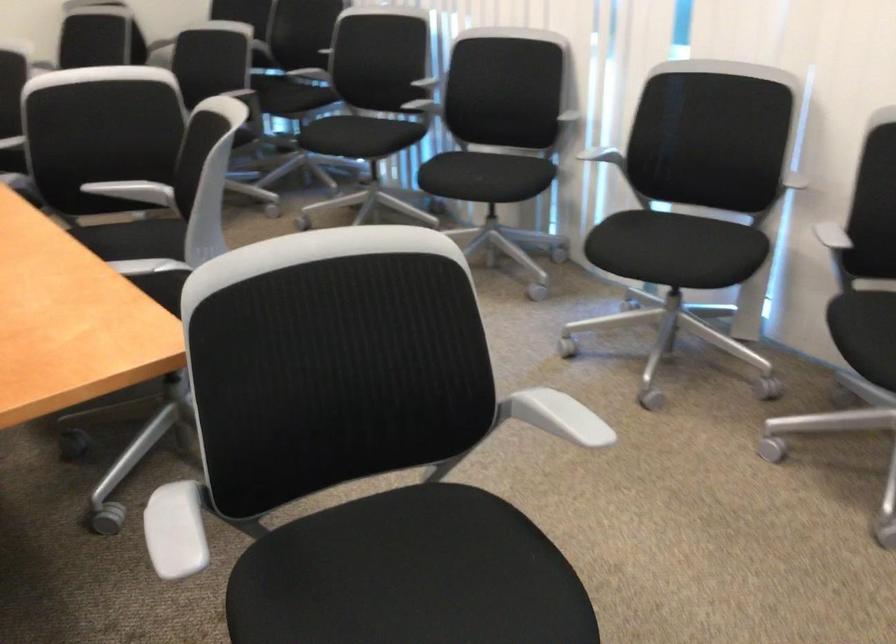
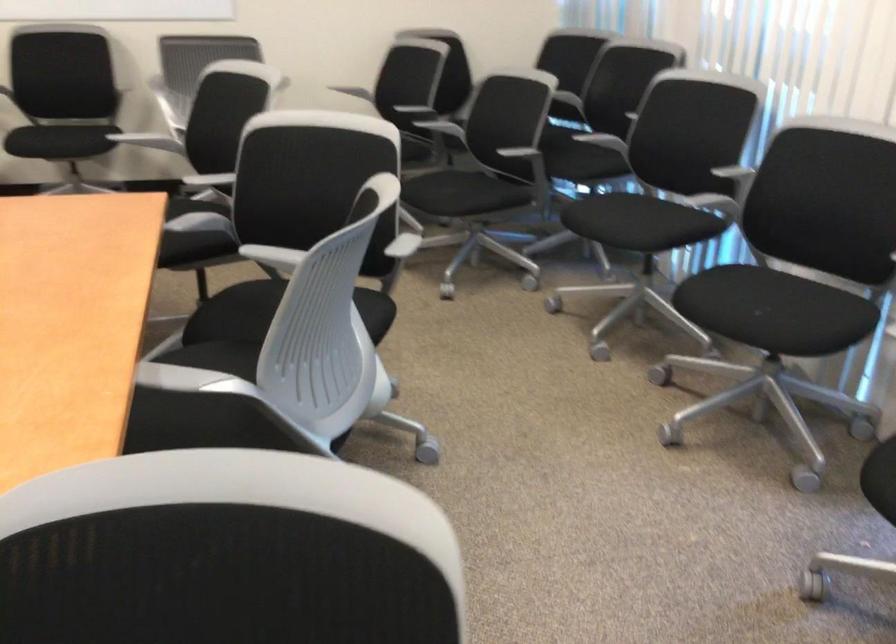
Question: The camera is either moving clockwise (left) or counter-clockwise (right) around the object. The first image is from the beginning of the video and the second image is from the end. Is the camera moving left or right when shooting the video?

Choices:
 (A) Left
 (B) Right

Answer: (B)